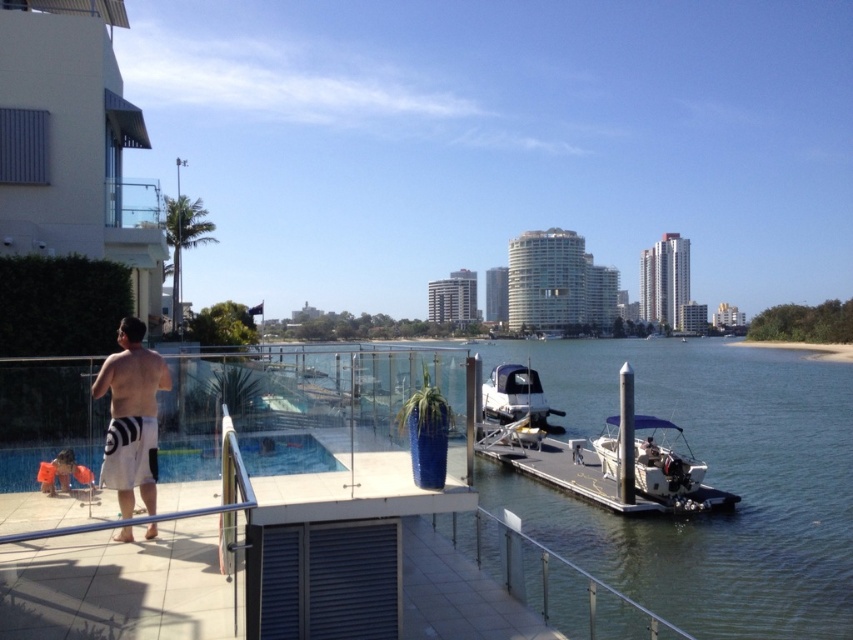
Which is behind, point (729, 436) or point (175, 456)?

The point (729, 436) is behind.

Find the location of a particular element. The width and height of the screenshot is (853, 640). clear water at center is located at coordinates [711, 483].

I want to click on clear water at center, so click(711, 483).

Is clear water at center further to the viewer compared to white matte boat at center?

Answer: No.

Is clear water at center above white matte boat at center?

No, clear water at center is not above white matte boat at center.

Does point (732, 518) lie in front of point (553, 429)?

Yes, point (732, 518) is in front of point (553, 429).

Where is `clear water at center`? clear water at center is located at coordinates (711, 483).

Is white cotton shorts at lower left taller than white matte boat at center?

No.

Measure the distance between white cotton shorts at lower left and white matte boat at center.

white cotton shorts at lower left and white matte boat at center are 27.93 meters apart.

You are a GUI agent. You are given a task and a screenshot of the screen. Output one action in this format:
    pyautogui.click(x=<x>, y=<y>)
    Task: Click on the white cotton shorts at lower left
    The width and height of the screenshot is (853, 640).
    Given the screenshot: What is the action you would take?
    pyautogui.click(x=131, y=417)